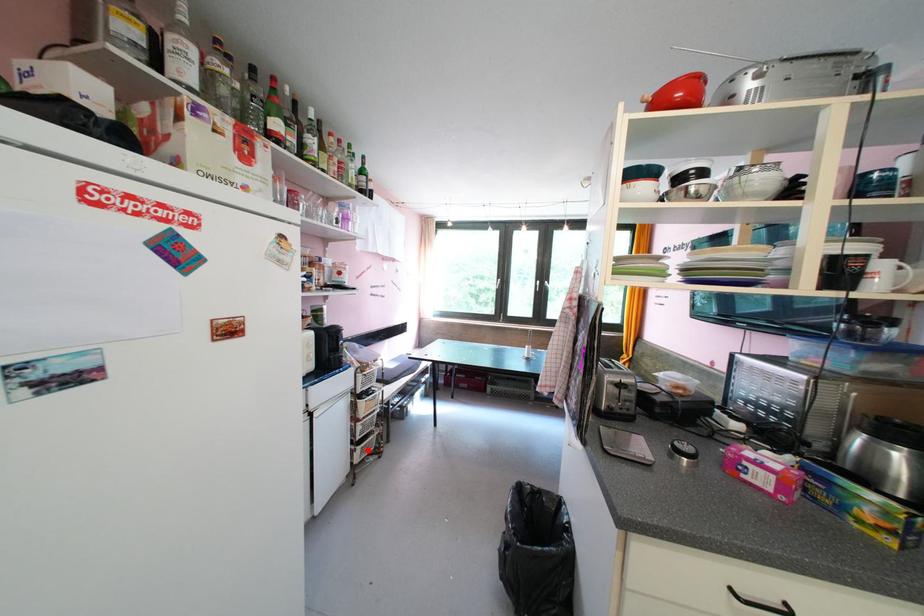
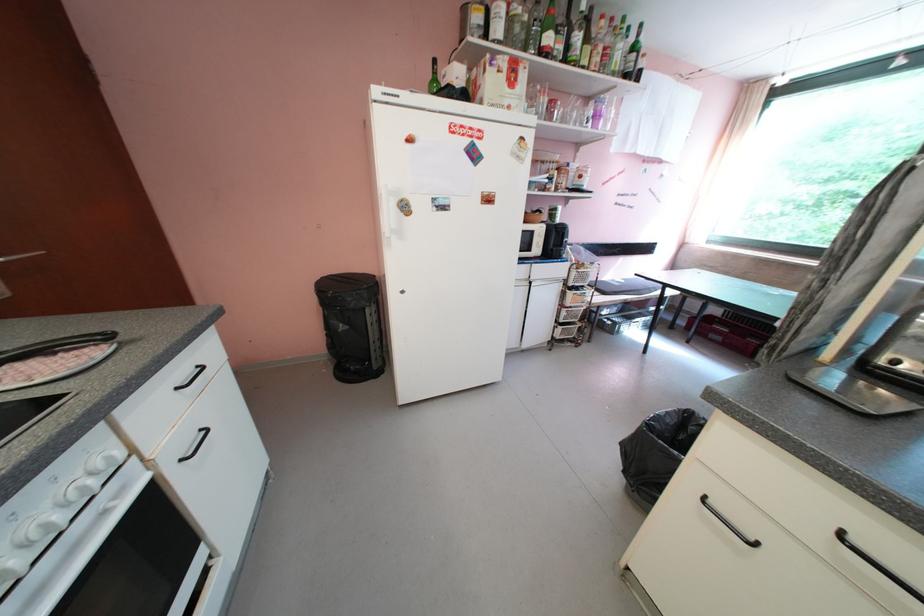
Find the pixel in the second image that matches the highlighted location in the first image.

(568, 330)